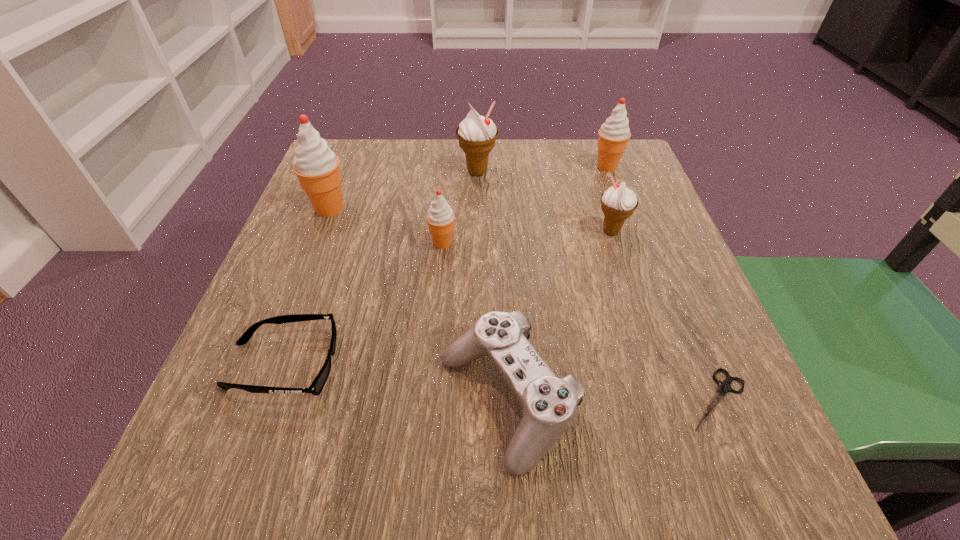
This screenshot has height=540, width=960. I want to click on unoccupied position between the shears and the second biggest red icecream, so click(662, 283).

Where is `free space between the control and the black shears`? free space between the control and the black shears is located at coordinates (612, 400).

Locate an element on the screen. Image resolution: width=960 pixels, height=540 pixels. empty space that is in between the right white icecream and the biggest red icecream is located at coordinates (470, 220).

Where is `free space between the farthest red icecream and the third shortest object`? free space between the farthest red icecream and the third shortest object is located at coordinates (557, 284).

Identify the location of unoccupied area between the black sunglasses and the leftmost icecream. (306, 287).

Identify the location of object that stands as the third closest to the bigger white icecream. The width and height of the screenshot is (960, 540). (317, 167).

I want to click on object that stands as the fifth closest to the third shortest object, so click(317, 167).

The width and height of the screenshot is (960, 540). Identify the location of the third closest icecream to the second red icecream from right to left. (618, 203).

Choose which icecream is the nearest neighbor to the left white icecream. Please provide its 2D coordinates. Your answer should be formatted as a tuple, i.e. [(x, y)], where the tuple contains the x and y coordinates of a point satisfying the conditions above.

[(440, 217)]

Point out which red icecream is positioned as the second nearest to the rightmost red icecream. Please provide its 2D coordinates. Your answer should be formatted as a tuple, i.e. [(x, y)], where the tuple contains the x and y coordinates of a point satisfying the conditions above.

[(317, 167)]